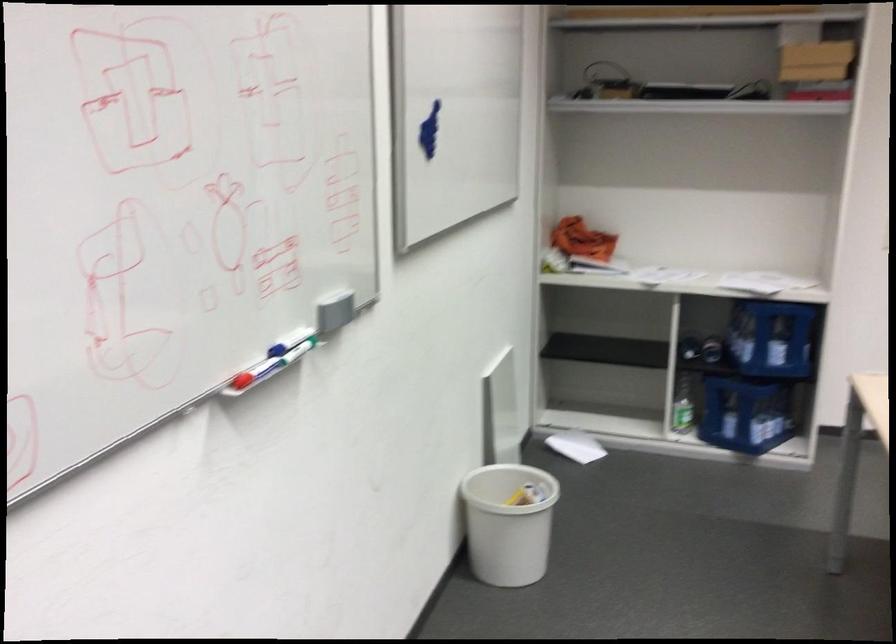
Which object does [334,310] point to?

It refers to a grey whiteboard eraser.